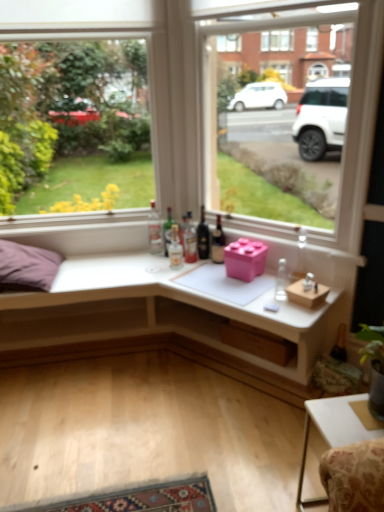
The height and width of the screenshot is (512, 384). In order to click on vacant point to the left of wooden box at right, the 2th window box in the bottom-to-top sequence in this screenshot , I will do `click(262, 301)`.